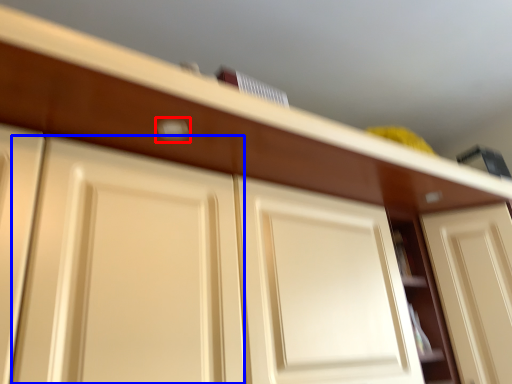
Question: Which of the following is the farthest to the observer, door handle (highlighted by a red box) or door (highlighted by a blue box)?

Choices:
 (A) door handle
 (B) door

Answer: (A)